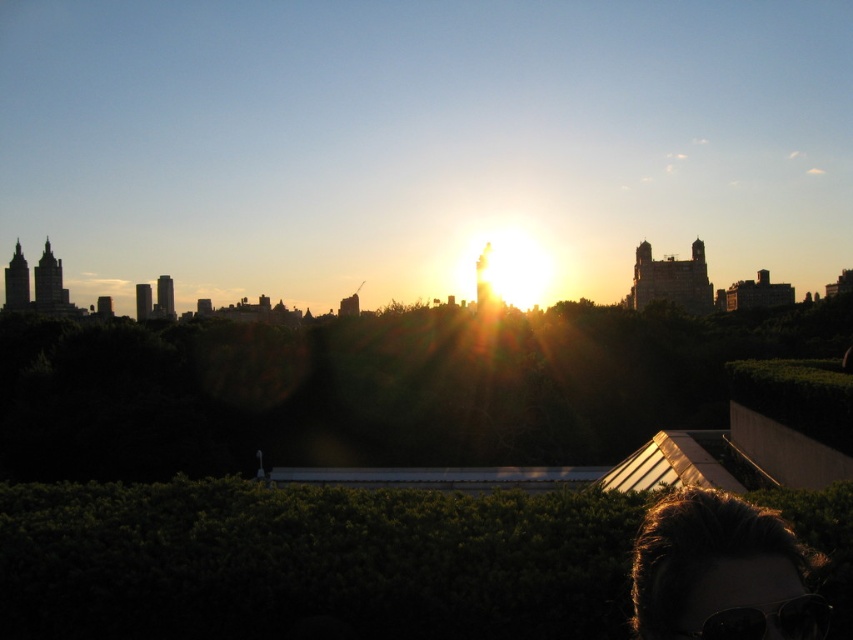
Which of these two, dark brown hair at lower right or black plastic goggles at lower right, stands shorter?

black plastic goggles at lower right

Between point (811, 625) and point (817, 609), which one is positioned behind?

Positioned behind is point (817, 609).

At what (x,y) coordinates should I click in order to perform the action: click on dark brown hair at lower right. Please return your answer as a coordinate pair (x, y). Looking at the image, I should click on (721, 572).

I want to click on dark brown hair at lower right, so click(x=721, y=572).